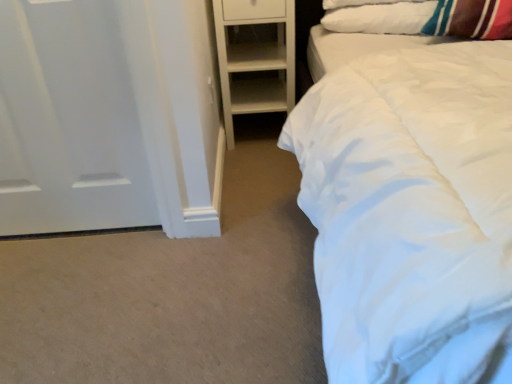
Locate an element on the screen. The height and width of the screenshot is (384, 512). white soft pillow at upper right is located at coordinates (380, 18).

Describe the element at coordinates (68, 122) in the screenshot. The height and width of the screenshot is (384, 512). I see `white matte door at left` at that location.

This screenshot has height=384, width=512. I want to click on white matte wooden shelf at center, so click(x=255, y=57).

Who is smaller, white matte door at left or white soft pillow at upper right?

Smaller between the two is white soft pillow at upper right.

Consider the image. Is white matte door at left turned away from white soft pillow at upper right?

That's not correct — white matte door at left is not looking away from white soft pillow at upper right.

Is white matte door at left inside or outside of white soft pillow at upper right?

white matte door at left is not enclosed by white soft pillow at upper right.

Which of these two, white matte door at left or white soft pillow at upper right, stands shorter?

white soft pillow at upper right.

How many degrees apart are the facing directions of white matte door at left and white matte wooden shelf at center?

1.79 degrees separate the facing orientations of white matte door at left and white matte wooden shelf at center.

Looking at this image, can you confirm if white matte door at left is thinner than white matte wooden shelf at center?

Correct, the width of white matte door at left is less than that of white matte wooden shelf at center.

Considering the positions of points (53, 139) and (288, 21), is point (53, 139) closer to camera compared to point (288, 21)?

Yes, point (53, 139) is closer to viewer.

Is white matte door at left further to the viewer compared to white matte wooden shelf at center?

No, it is not.

Does point (321, 19) come farther from viewer compared to point (95, 64)?

That is True.

Between white soft pillow at upper right and white matte door at left, which one has larger width?

white soft pillow at upper right is wider.

Consider the image. Is white soft pillow at upper right facing away from white matte door at left?

No, white soft pillow at upper right's orientation is not away from white matte door at left.

Between white soft pillow at upper right and white matte door at left, which one has less height?

white soft pillow at upper right is shorter.

Is the surface of white matte wooden shelf at center in direct contact with white matte door at left?

No, white matte wooden shelf at center is not next to white matte door at left.

Considering the sizes of objects white matte wooden shelf at center and white matte door at left in the image provided, who is taller, white matte wooden shelf at center or white matte door at left?

Standing taller between the two is white matte door at left.

Looking at this image, from the image's perspective, which is above, white matte wooden shelf at center or white matte door at left?

white matte wooden shelf at center, from the image's perspective.

From a real-world perspective, who is located lower, white matte wooden shelf at center or white matte door at left?

From a 3D spatial view, white matte wooden shelf at center is below.

Is point (241, 24) positioned before point (357, 13)?

That is False.

From their relative heights in the image, would you say white matte wooden shelf at center is taller or shorter than white soft pillow at upper right?

white matte wooden shelf at center is taller than white soft pillow at upper right.

Considering the relative sizes of white matte wooden shelf at center and white soft pillow at upper right in the image provided, is white matte wooden shelf at center smaller than white soft pillow at upper right?

No.

Is white matte wooden shelf at center facing away from white soft pillow at upper right?

That's not correct — white matte wooden shelf at center is not looking away from white soft pillow at upper right.

This screenshot has width=512, height=384. In order to click on pillow lying in front of the white matte wooden shelf at center in this screenshot , I will do `click(380, 18)`.

Does white soft pillow at upper right have a greater height compared to white matte wooden shelf at center?

In fact, white soft pillow at upper right may be shorter than white matte wooden shelf at center.

From a real-world perspective, between white soft pillow at upper right and white matte wooden shelf at center, who is vertically higher?

white soft pillow at upper right.

Where is `pillow on the right side of white matte door at left`? The width and height of the screenshot is (512, 384). pillow on the right side of white matte door at left is located at coordinates (380, 18).

Where is `shelf located behind the white matte door at left`? This screenshot has height=384, width=512. shelf located behind the white matte door at left is located at coordinates (255, 57).

Estimate the real-world distances between objects in this image. Which object is further from white soft pillow at upper right, white matte wooden shelf at center or white matte door at left?

white matte door at left is positioned further to the anchor white soft pillow at upper right.

Which object lies further to the anchor point white soft pillow at upper right, white matte door at left or white matte wooden shelf at center?

Based on the image, white matte door at left appears to be further to white soft pillow at upper right.

Estimate the real-world distances between objects in this image. Which object is further from white matte wooden shelf at center, white matte door at left or white soft pillow at upper right?

white matte door at left is further to white matte wooden shelf at center.

Considering their positions, is white soft pillow at upper right positioned closer to white matte wooden shelf at center than white matte door at left?

Among the two, white soft pillow at upper right is located nearer to white matte wooden shelf at center.

From the image, which object appears to be farther from white matte door at left, white soft pillow at upper right or white matte wooden shelf at center?

Among the two, white soft pillow at upper right is located further to white matte door at left.

From the image, which object appears to be farther from white matte door at left, white matte wooden shelf at center or white soft pillow at upper right?

white soft pillow at upper right is further to white matte door at left.

Find the location of a particular element. shelf located between white matte door at left and white soft pillow at upper right in the left-right direction is located at coordinates (255, 57).